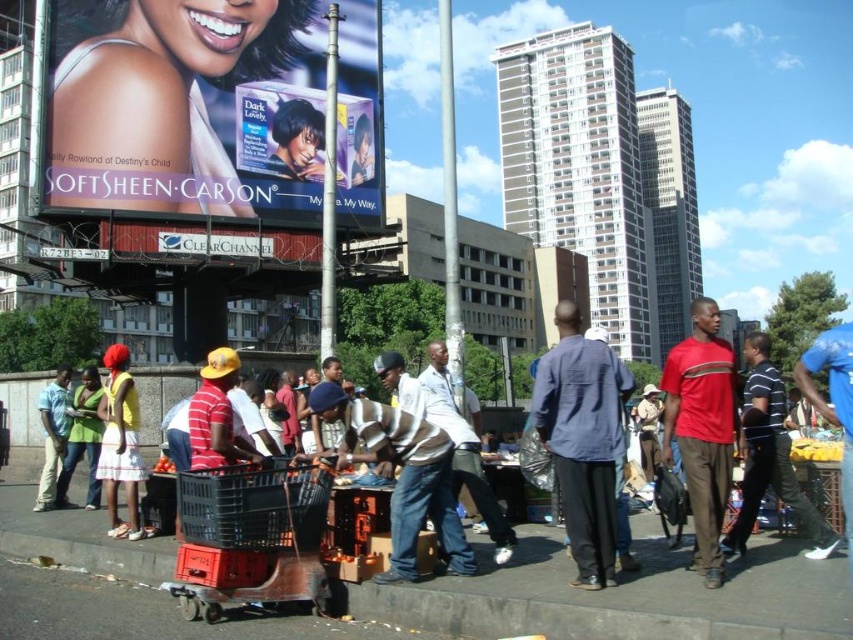
Looking at this image, you are a customer at the market stall. You notice two items for sale, the matte yellow dress at center and the light blue denim jeans at lower left. Which item is positioned higher in the image?

The matte yellow dress at center is positioned higher than the light blue denim jeans at lower left in the image.

You are a pedestrian walking down the street and see the blue cotton shirt at center and the matte plastic poster at upper center. Which object is located to the right of the other?

The blue cotton shirt at center is positioned on the right side of matte plastic poster at upper center.